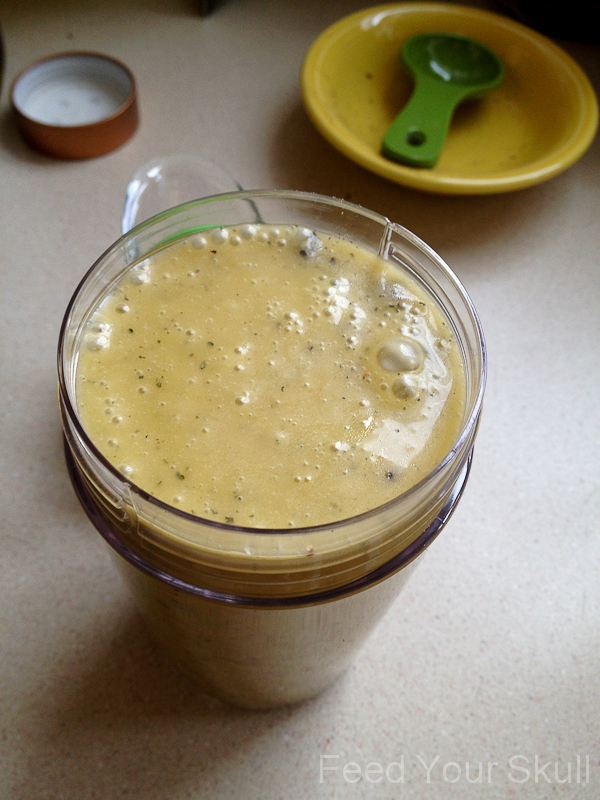
In order to click on cup in this screenshot , I will do `click(307, 581)`.